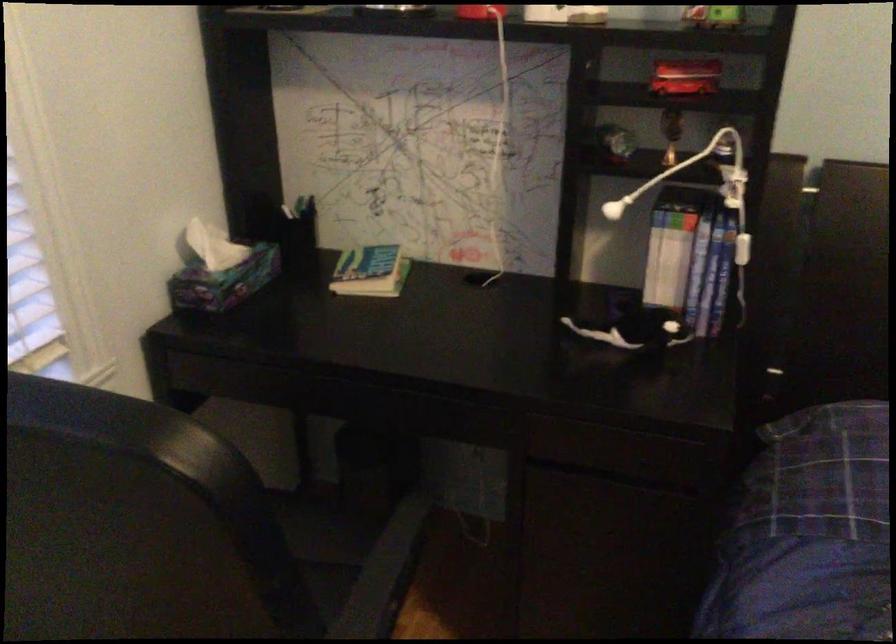
The location [295,211] corresponds to which object?

It refers to a dark pen.